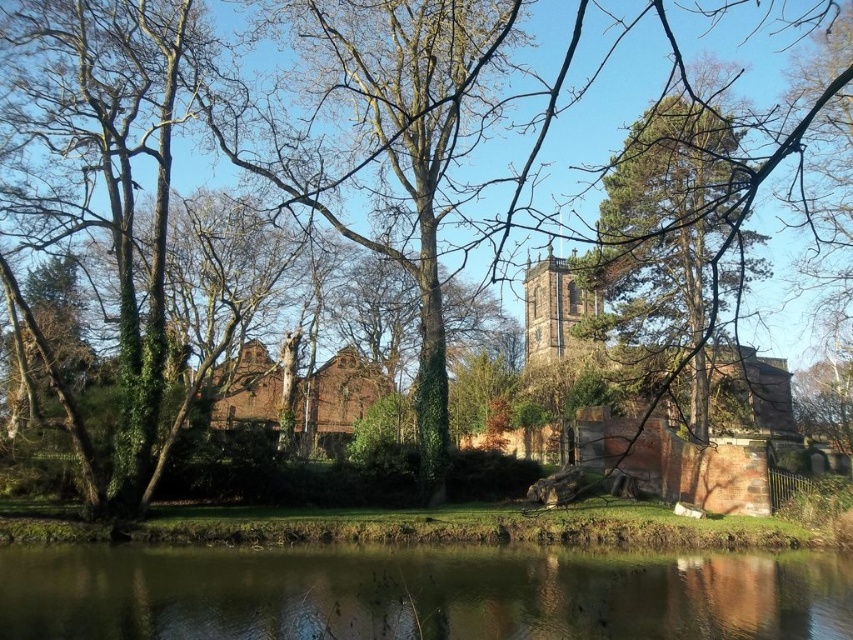
You are standing in front of the historic stone church and want to walk to the point marked at coordinates point(741, 161) and point(300, 388). Which point will you reach first?

Point(741, 161) is closer to the viewer than point(300, 388), so you will reach point(741, 161) first.

You are standing in the churchyard and want to take a photo of the green leafy tree at center. If your camera has a maximum focus distance of 3 meters, will you be able to capture the tree clearly?

The green leafy tree at center is 2.89 meters away from the viewer, so yes, the camera can focus on it since the distance is within the 3 meters limit.